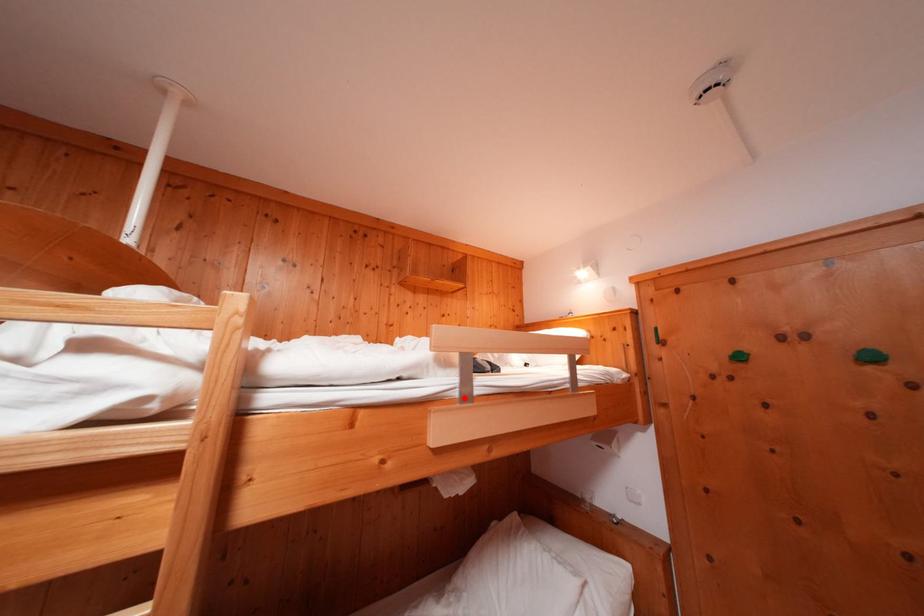
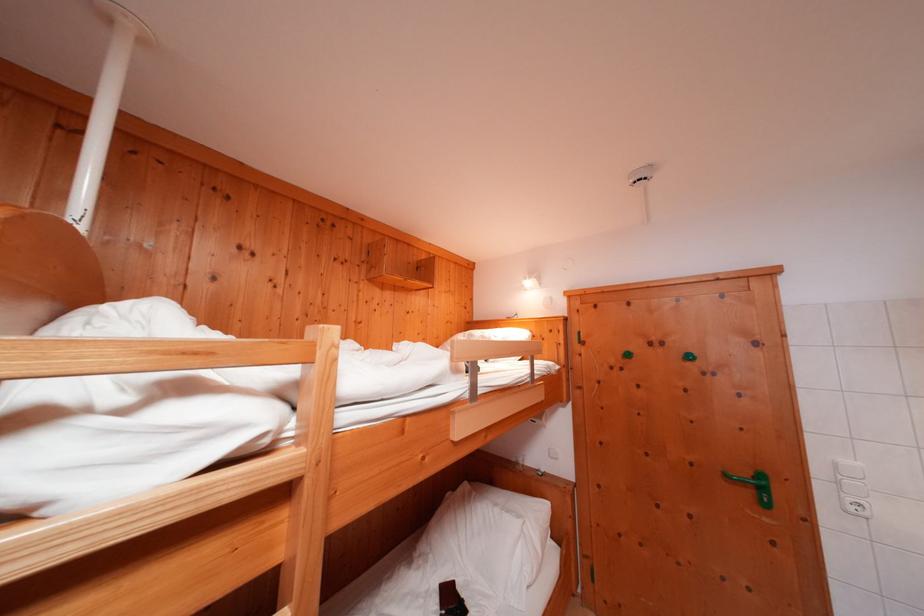
Find the pixel in the second image that matches the highlighted location in the first image.

(476, 399)